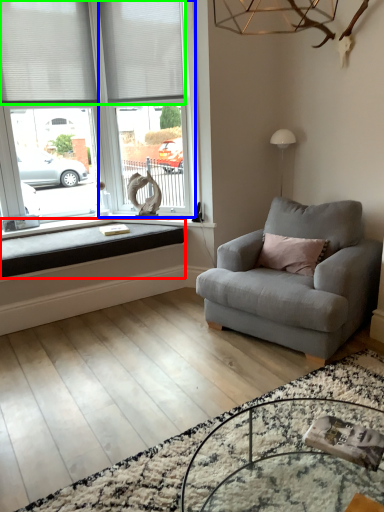
Question: Considering the real-world distances, which object is farthest from window sill (highlighted by a red box)? window frame (highlighted by a blue box) or blind (highlighted by a green box)?

Choices:
 (A) window frame
 (B) blind

Answer: (B)